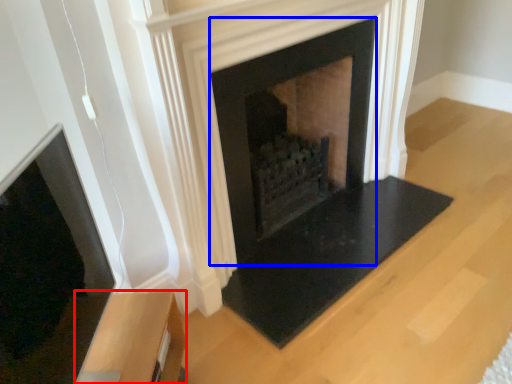
Question: Which of the following is the closest to the observer, furniture (highlighted by a red box) or fireplace (highlighted by a blue box)?

Choices:
 (A) furniture
 (B) fireplace

Answer: (A)